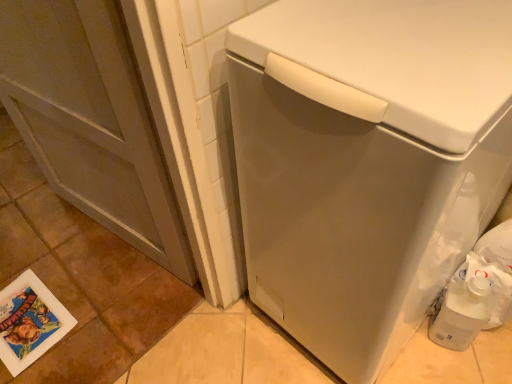
Question: From a real-world perspective, is white matte washing machine at center physically above matte gray screen door at left?

Choices:
 (A) no
 (B) yes

Answer: (B)

Question: From a real-world perspective, is white matte washing machine at center beneath matte gray screen door at left?

Choices:
 (A) no
 (B) yes

Answer: (A)

Question: Does white matte washing machine at center lie behind matte gray screen door at left?

Choices:
 (A) no
 (B) yes

Answer: (A)

Question: Is white matte washing machine at center directly adjacent to matte gray screen door at left?

Choices:
 (A) yes
 (B) no

Answer: (B)

Question: Is white matte washing machine at center oriented away from matte gray screen door at left?

Choices:
 (A) yes
 (B) no

Answer: (B)

Question: Can you confirm if white matte washing machine at center is bigger than matte gray screen door at left?

Choices:
 (A) yes
 (B) no

Answer: (A)

Question: Considering the relative sizes of printed paper postcard at lower left and matte gray screen door at left in the image provided, is printed paper postcard at lower left wider than matte gray screen door at left?

Choices:
 (A) no
 (B) yes

Answer: (B)

Question: Is printed paper postcard at lower left to the right of matte gray screen door at left from the viewer's perspective?

Choices:
 (A) yes
 (B) no

Answer: (B)

Question: Is printed paper postcard at lower left outside matte gray screen door at left?

Choices:
 (A) no
 (B) yes

Answer: (B)

Question: From the image's perspective, would you say printed paper postcard at lower left is positioned over matte gray screen door at left?

Choices:
 (A) yes
 (B) no

Answer: (B)

Question: Is printed paper postcard at lower left further to the viewer compared to matte gray screen door at left?

Choices:
 (A) no
 (B) yes

Answer: (B)

Question: Is printed paper postcard at lower left thinner than matte gray screen door at left?

Choices:
 (A) no
 (B) yes

Answer: (A)

Question: Is printed paper postcard at lower left smaller than white matte washing machine at center?

Choices:
 (A) no
 (B) yes

Answer: (B)